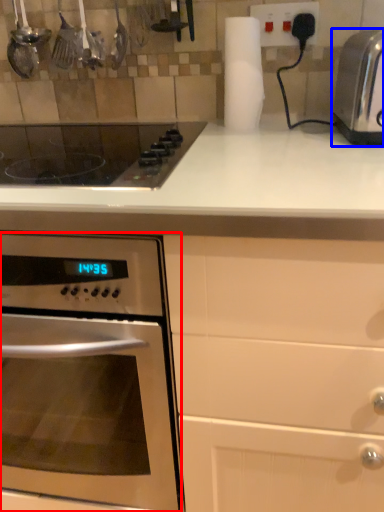
Question: Among these objects, which one is nearest to the camera, oven (highlighted by a red box) or toaster (highlighted by a blue box)?

Choices:
 (A) oven
 (B) toaster

Answer: (A)